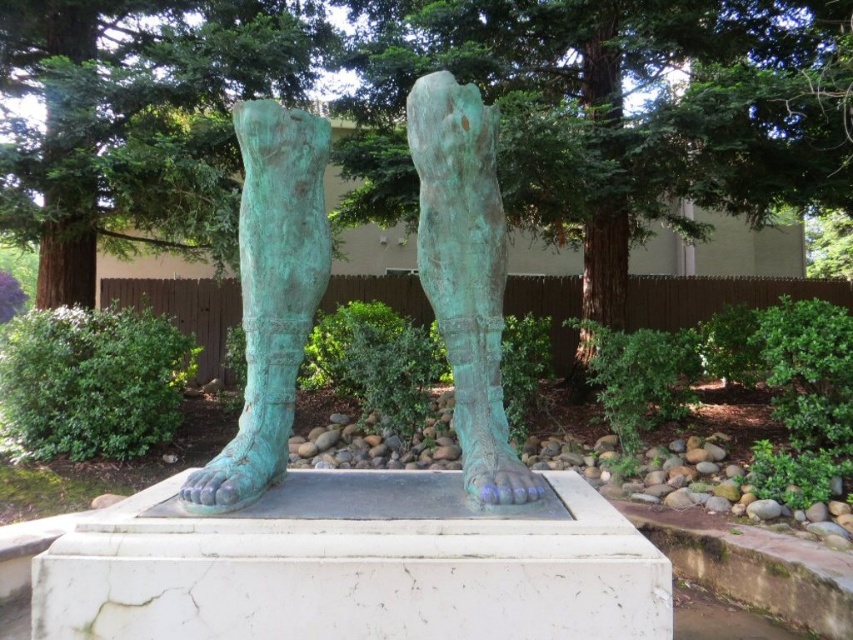
Question: Which point appears farthest from the camera in this image?

Choices:
 (A) (476, 234)
 (B) (257, 404)
 (C) (463, 131)

Answer: (A)

Question: Which object is positioned closest to the green patina bronze feet at center?

Choices:
 (A) green patina leg at center
 (B) green patina foot at center

Answer: (B)

Question: Which of the following is the farthest from the observer?

Choices:
 (A) green patina bronze feet at center
 (B) green patina foot at center
 (C) green patina leg at center

Answer: (B)

Question: Is green patina bronze feet at center wider than green patina leg at center?

Choices:
 (A) no
 (B) yes

Answer: (B)

Question: Can you confirm if green patina bronze feet at center is thinner than green patina leg at center?

Choices:
 (A) yes
 (B) no

Answer: (B)

Question: In this image, where is green patina bronze feet at center located relative to green patina leg at center?

Choices:
 (A) below
 (B) above

Answer: (B)